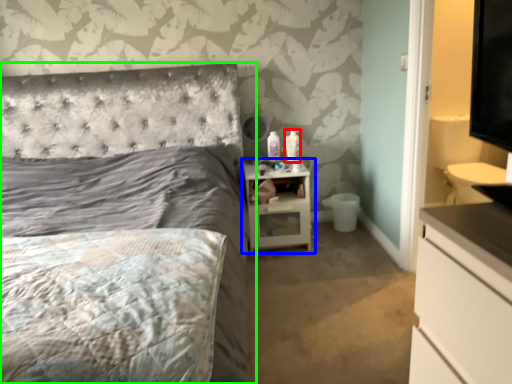
Question: Estimate the real-world distances between objects in this image. Which object is closer to toiletry (highlighted by a red box), nightstand (highlighted by a blue box) or bed (highlighted by a green box)?

Choices:
 (A) nightstand
 (B) bed

Answer: (A)